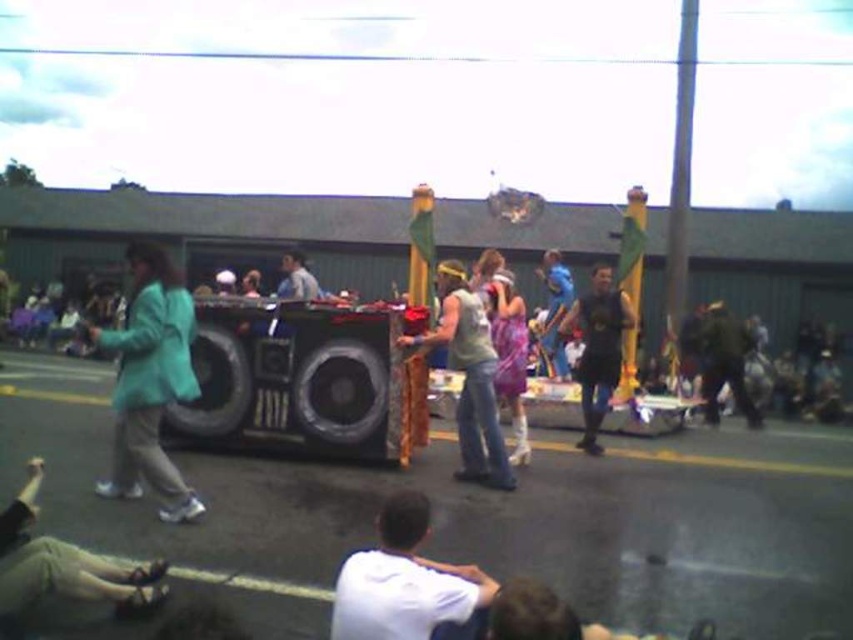
You are a photographer trying to capture the float and the people around it. You notice two individuals wearing a black matte tank top at center and a light blue shirt at center. Which person is positioned lower in the image?

The black matte tank top at center is located below the light blue shirt at center, so the person wearing the black matte tank top at center is positioned lower in the image.

You are organizing a parade and need to ensure that the shiny black speaker at center and the matte gold fabric at center can fit through a narrow alleyway that is 1.2 meters wide. Based on their sizes, will both items fit side by side?

The shiny black speaker at center is larger in width than the matte gold fabric at center. Since the alleyway is only 1.2 meters wide, it is uncertain if both can fit side by side without overlapping unless the combined width of both items is less than or equal to 1.2 meters. However, since the exact widths are not provided, we cannot confirm definitively.